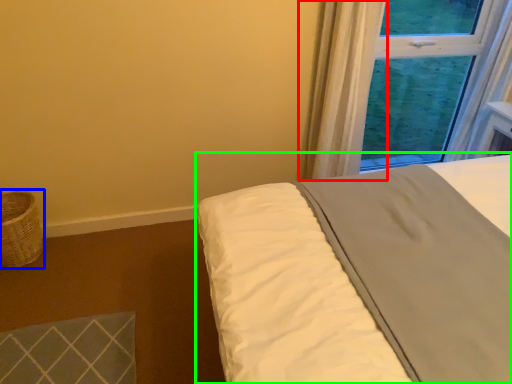
Question: Estimate the real-world distances between objects in this image. Which object is closer to curtain (highlighted by a red box), basket (highlighted by a blue box) or bed (highlighted by a green box)?

Choices:
 (A) basket
 (B) bed

Answer: (B)